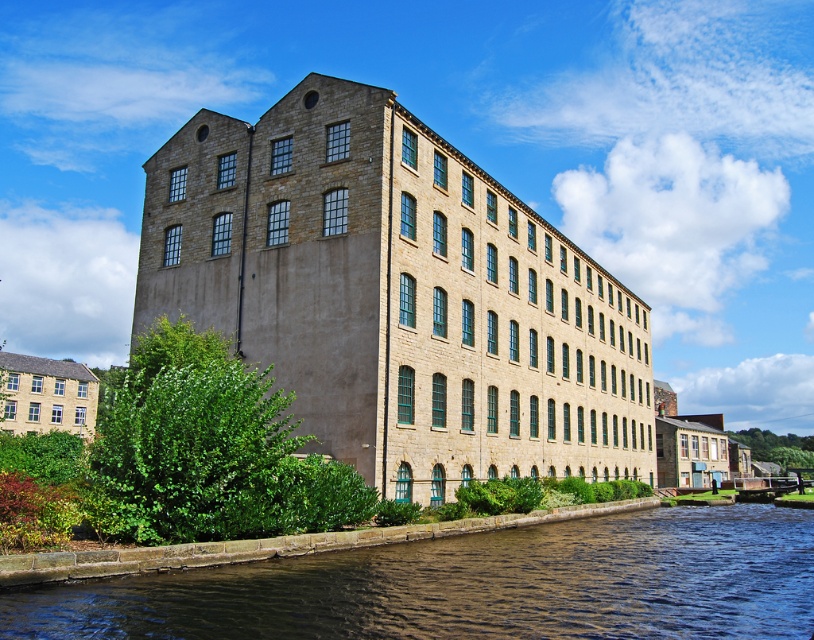
You are standing on the bank of the brown water at lower center and want to cross to the beige stone building at center. Which direction should you walk to face the building?

You should walk to the right because the beige stone building at center is to the right of the brown water at lower center, so facing that direction will lead you towards it.

Based on the scene description, which object is wider, the beige stone building at center or the brown water at lower center?

The beige stone building at center is wider than the brown water at lower center according to the description.

Based on the photo, you are standing at the edge of the canal in front of the beige stone building at center. You want to take a photo of the building with your camera. If your camera can focus on objects up to 50 meters away, will it be able to capture the building clearly?

The beige stone building at center and camera are 45.56 meters apart. Since the camera can focus up to 50 meters, it will be able to capture the building clearly.